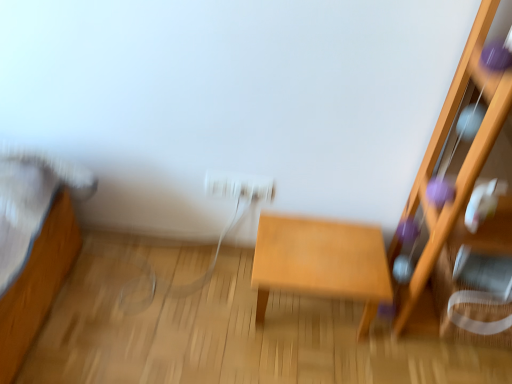
Question: Is light brown wooden table at center looking in the opposite direction of wooden shelf at right?

Choices:
 (A) no
 (B) yes

Answer: (A)

Question: Is light brown wooden table at center at the right side of wooden shelf at right?

Choices:
 (A) yes
 (B) no

Answer: (B)

Question: Does light brown wooden table at center have a greater width compared to wooden shelf at right?

Choices:
 (A) yes
 (B) no

Answer: (B)

Question: Is light brown wooden table at center behind wooden shelf at right?

Choices:
 (A) yes
 (B) no

Answer: (A)

Question: From the image's perspective, is light brown wooden table at center on wooden shelf at right?

Choices:
 (A) yes
 (B) no

Answer: (B)

Question: Considering the positions of point [266, 178] and point [417, 284], is point [266, 178] closer or farther from the camera than point [417, 284]?

Choices:
 (A) farther
 (B) closer

Answer: (A)

Question: Is white glossy electric outlet at center bigger or smaller than wooden shelf at right?

Choices:
 (A) small
 (B) big

Answer: (A)

Question: In terms of height, does white glossy electric outlet at center look taller or shorter compared to wooden shelf at right?

Choices:
 (A) short
 (B) tall

Answer: (A)

Question: From the image's perspective, relative to wooden shelf at right, is white glossy electric outlet at center above or below?

Choices:
 (A) below
 (B) above

Answer: (B)

Question: From the image's perspective, relative to white glossy electric outlet at center, is light brown wooden table at center above or below?

Choices:
 (A) below
 (B) above

Answer: (A)

Question: In the image, is light brown wooden table at center positioned in front of or behind white glossy electric outlet at center?

Choices:
 (A) front
 (B) behind

Answer: (A)

Question: Would you say light brown wooden table at center is inside or outside white glossy electric outlet at center?

Choices:
 (A) outside
 (B) inside

Answer: (A)

Question: In terms of width, does light brown wooden table at center look wider or thinner when compared to white glossy electric outlet at center?

Choices:
 (A) thin
 (B) wide

Answer: (B)

Question: Considering the positions of wooden shelf at right and white glossy electric outlet at center in the image, is wooden shelf at right wider or thinner than white glossy electric outlet at center?

Choices:
 (A) wide
 (B) thin

Answer: (A)

Question: Is point (507, 231) positioned closer to the camera than point (205, 190)?

Choices:
 (A) farther
 (B) closer

Answer: (B)